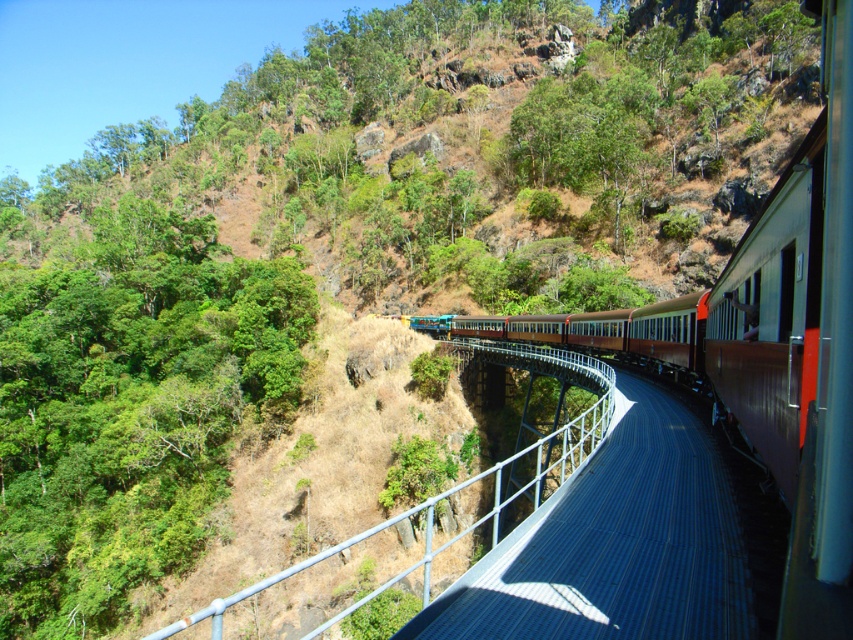
Describe the element at coordinates (799, 346) in the screenshot. The height and width of the screenshot is (640, 853). I see `brown metal train at center` at that location.

Which of these two, brown metal train at center or metallic blue rail at center, stands taller?

With more height is metallic blue rail at center.

Is point (821, 381) positioned after point (389, 568)?

No, (821, 381) is closer to viewer.

Where is `brown metal train at center`? This screenshot has height=640, width=853. brown metal train at center is located at coordinates (799, 346).